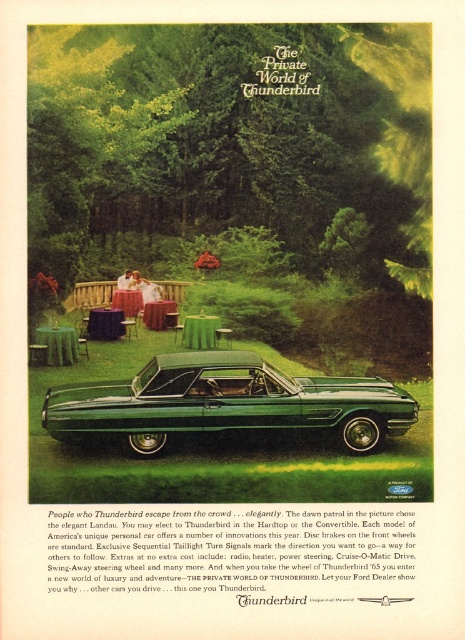
Is green metallic car at lower center bigger than green fabric picnic table at lower left?

Yes, green metallic car at lower center is bigger than green fabric picnic table at lower left.

Is point (114, 397) farther from camera compared to point (60, 339)?

No, it is in front of (60, 339).

Which is behind, point (198, 419) or point (47, 346)?

The point (47, 346) is behind.

Locate an element on the screen. green metallic car at lower center is located at coordinates 225,403.